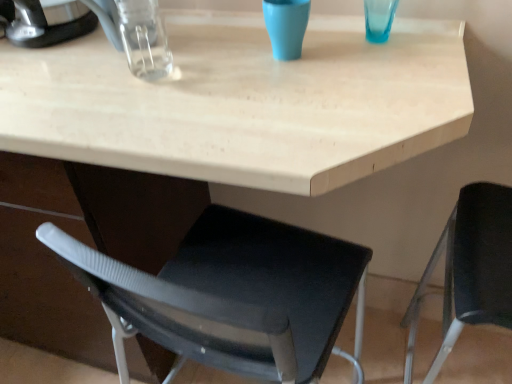
Question: Is matte blue cup at upper center not inside brushed metal coffee maker at upper left?

Choices:
 (A) yes
 (B) no

Answer: (A)

Question: From a real-world perspective, is matte blue cup at upper center beneath brushed metal coffee maker at upper left?

Choices:
 (A) no
 (B) yes

Answer: (B)

Question: Is matte blue cup at upper center surrounding brushed metal coffee maker at upper left?

Choices:
 (A) yes
 (B) no

Answer: (B)

Question: Considering the relative sizes of matte blue cup at upper center and brushed metal coffee maker at upper left in the image provided, is matte blue cup at upper center wider than brushed metal coffee maker at upper left?

Choices:
 (A) yes
 (B) no

Answer: (B)

Question: Is matte blue cup at upper center behind brushed metal coffee maker at upper left?

Choices:
 (A) yes
 (B) no

Answer: (B)

Question: Do you think matte blue cup at upper center is within black plastic chair at right, or outside of it?

Choices:
 (A) inside
 (B) outside

Answer: (B)

Question: From the image's perspective, is matte blue cup at upper center located above or below black plastic chair at right?

Choices:
 (A) above
 (B) below

Answer: (A)

Question: Considering the positions of matte blue cup at upper center and black plastic chair at right in the image, is matte blue cup at upper center wider or thinner than black plastic chair at right?

Choices:
 (A) wide
 (B) thin

Answer: (B)

Question: Is point (295, 21) positioned closer to the camera than point (480, 233)?

Choices:
 (A) closer
 (B) farther

Answer: (A)

Question: From the image's perspective, is black plastic chair at right above or below brushed metal coffee maker at upper left?

Choices:
 (A) above
 (B) below

Answer: (B)

Question: Is black plastic chair at right in front of or behind brushed metal coffee maker at upper left in the image?

Choices:
 (A) behind
 (B) front

Answer: (B)

Question: Would you say black plastic chair at right is to the left or to the right of brushed metal coffee maker at upper left in the picture?

Choices:
 (A) right
 (B) left

Answer: (A)

Question: Do you think black plastic chair at right is within brushed metal coffee maker at upper left, or outside of it?

Choices:
 (A) inside
 (B) outside

Answer: (B)

Question: Considering their positions, is matte blue cup at upper center located in front of or behind brushed metal coffee maker at upper left?

Choices:
 (A) front
 (B) behind

Answer: (A)

Question: From a real-world perspective, is matte blue cup at upper center above or below brushed metal coffee maker at upper left?

Choices:
 (A) below
 (B) above

Answer: (A)